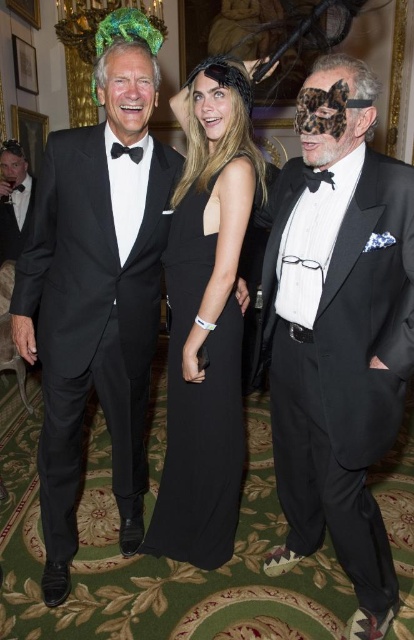
Is black satin tuxedo at left to the right of black satin dress at center from the viewer's perspective?

In fact, black satin tuxedo at left is to the left of black satin dress at center.

Can you confirm if black satin tuxedo at left is shorter than black satin dress at center?

No, black satin tuxedo at left is not shorter than black satin dress at center.

Image resolution: width=414 pixels, height=640 pixels. In order to click on black satin tuxedo at left in this screenshot , I will do `click(96, 289)`.

Find the location of a particular element. Image resolution: width=414 pixels, height=640 pixels. black satin tuxedo at left is located at coordinates (96, 289).

Can you confirm if matte black tuxedo at right is positioned above matte black tuxedo at left?

Incorrect, matte black tuxedo at right is not positioned above matte black tuxedo at left.

The image size is (414, 640). What are the coordinates of `matte black tuxedo at right` in the screenshot? It's located at (339, 332).

Does point (375, 589) come closer to viewer compared to point (24, 172)?

Yes, it is in front of point (24, 172).

Find the location of a particular element. This screenshot has width=414, height=640. matte black tuxedo at right is located at coordinates (339, 332).

Does black satin tuxedo at left appear over black satin bow tie at left?

Actually, black satin tuxedo at left is below black satin bow tie at left.

Identify the location of black satin tuxedo at left. The image size is (414, 640). (96, 289).

You are a GUI agent. You are given a task and a screenshot of the screen. Output one action in this format:
    pyautogui.click(x=<x>, y=<y>)
    Task: Click on the black satin tuxedo at left
    This screenshot has height=640, width=414.
    Given the screenshot: What is the action you would take?
    pyautogui.click(x=96, y=289)